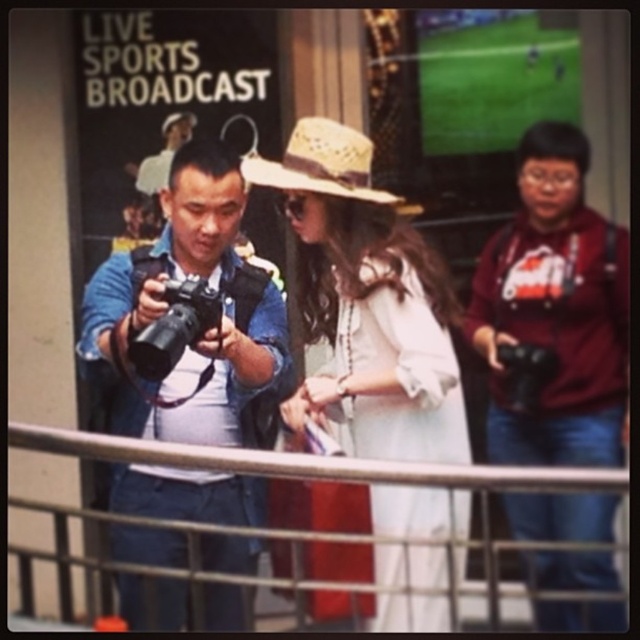
Question: Which point is farther from the camera taking this photo?

Choices:
 (A) (291, 144)
 (B) (596, 579)
 (C) (172, 360)

Answer: (B)

Question: Which of the following is the closest to the observer?

Choices:
 (A) (250, 173)
 (B) (531, 394)
 (C) (388, 221)
 (D) (150, 452)

Answer: (D)

Question: Can you confirm if maroon fabric shirt at right is positioned below metallic silver railing at center?

Choices:
 (A) no
 (B) yes

Answer: (A)

Question: Can you confirm if white cotton dress at center is thinner than metallic silver railing at center?

Choices:
 (A) no
 (B) yes

Answer: (B)

Question: Does white cotton dress at center appear over metallic silver railing at center?

Choices:
 (A) no
 (B) yes

Answer: (B)

Question: Among these points, which one is farthest from the camera?

Choices:
 (A) (304, 390)
 (B) (193, 298)

Answer: (A)